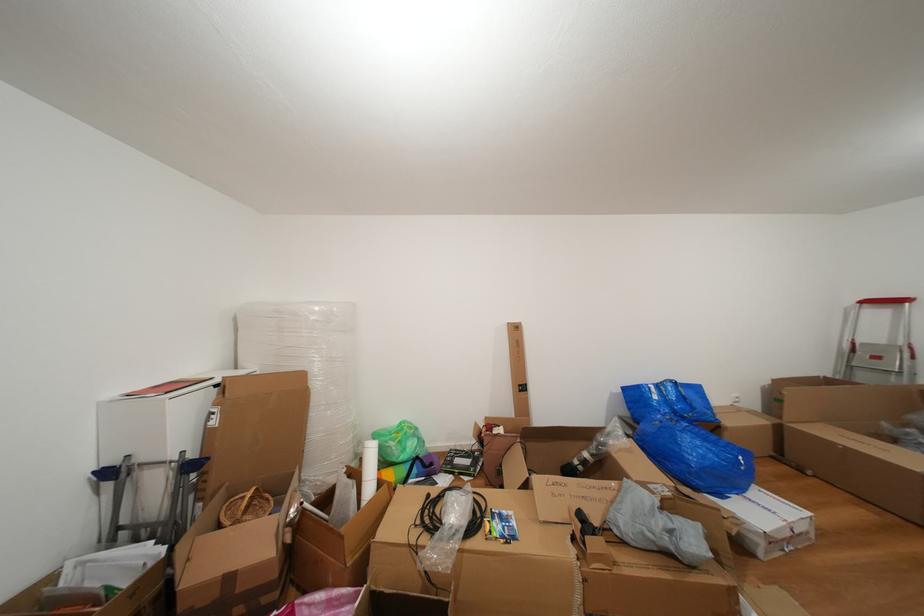
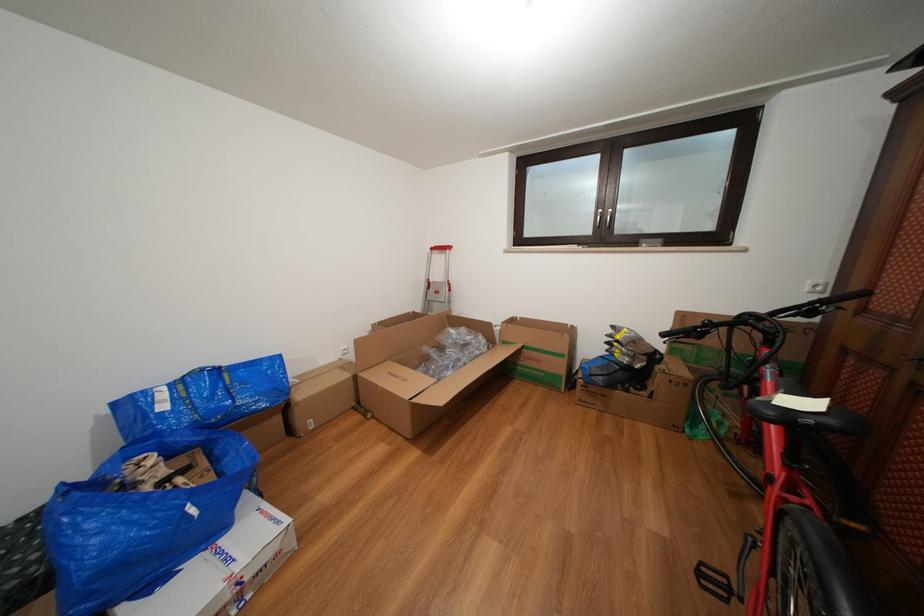
The point at (736, 428) is marked in the first image. Where is the corresponding point in the second image?

(309, 400)